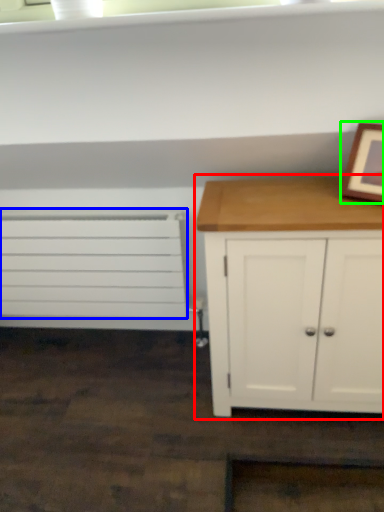
Question: Based on their relative distances, which object is nearer to chest of drawers (highlighted by a red box)? Choose from drawer (highlighted by a blue box) and picture frame (highlighted by a green box).

Choices:
 (A) drawer
 (B) picture frame

Answer: (B)